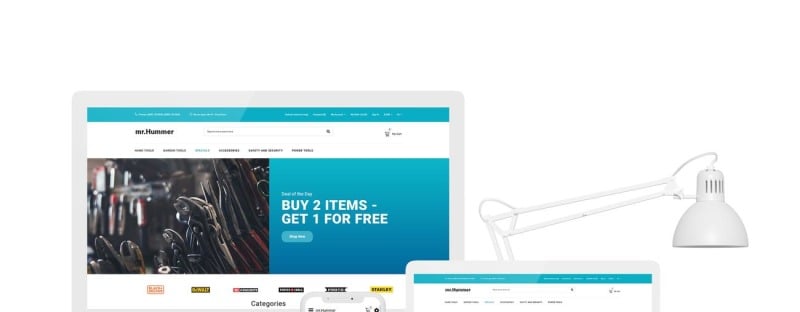
Find the location of a particular element. phone is located at coordinates (360, 293).